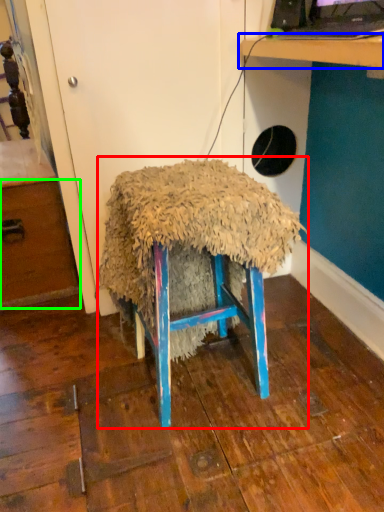
Question: Based on their relative distances, which object is nearer to furniture (highlighted by a red box)? Choose from table (highlighted by a blue box) and drawer (highlighted by a green box).

Choices:
 (A) table
 (B) drawer

Answer: (A)